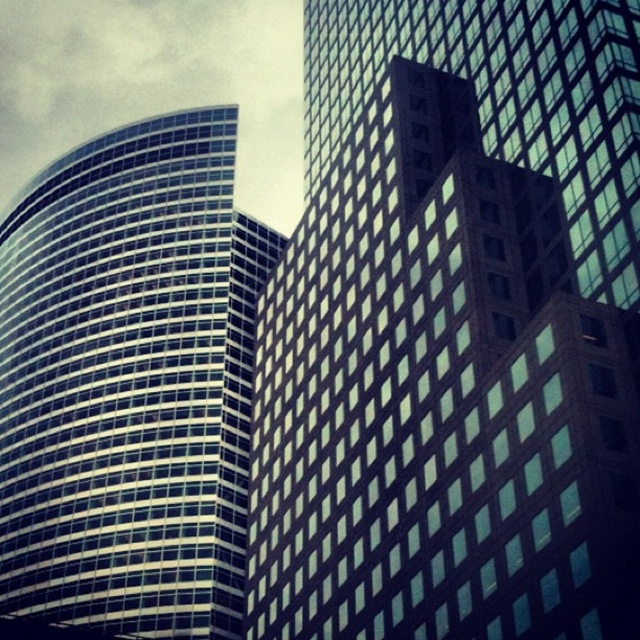
You are an architect analyzing the urban layout. You observe the glassy reflective skyscraper at center and the glassy reflective skyscraper at left in the image. Which skyscraper appears to be closer to the viewer?

The glassy reflective skyscraper at center is positioned over the glassy reflective skyscraper at left, so it appears closer to the viewer.

You are an architect analyzing the urban skyline. You observe the glassy reflective skyscraper at center and the glassy reflective skyscraper at left. Which of these two buildings is shorter?

The glassy reflective skyscraper at center is not as tall as the glassy reflective skyscraper at left, so the glassy reflective skyscraper at center is shorter.